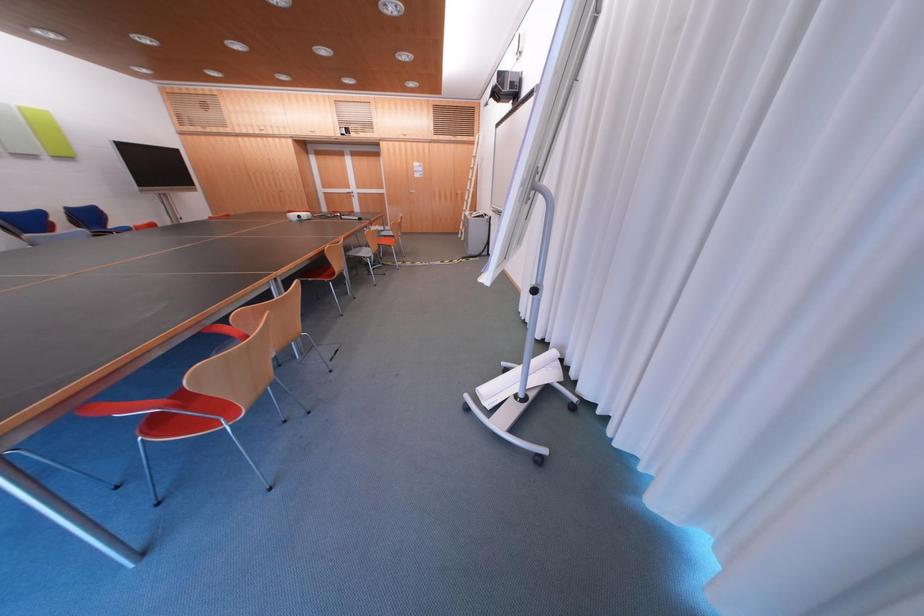
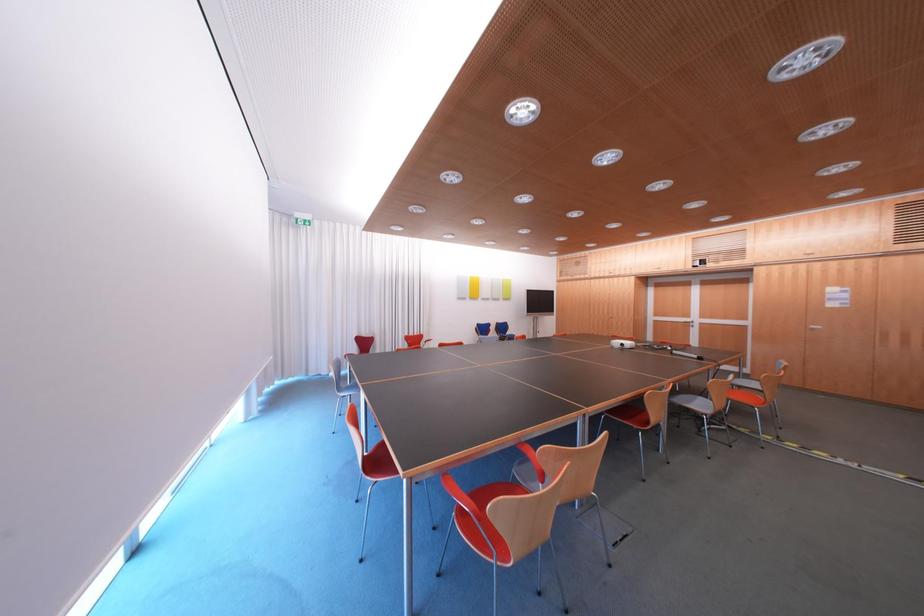
Question: How did the camera likely rotate?

Choices:
 (A) Left
 (B) Right
 (C) Up
 (D) Down

Answer: (A)